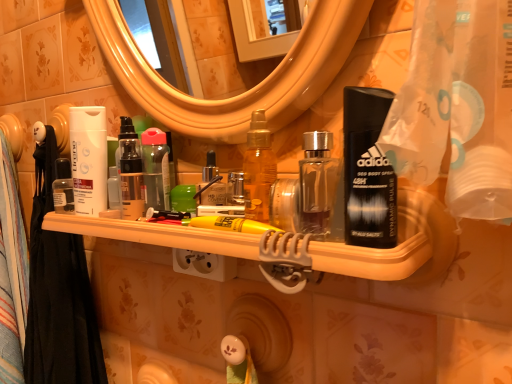
The width and height of the screenshot is (512, 384). Describe the element at coordinates (156, 169) in the screenshot. I see `transparent plastic bottle at center` at that location.

Where is `glossy plastic mirror at upper center`? This screenshot has width=512, height=384. glossy plastic mirror at upper center is located at coordinates (246, 91).

This screenshot has height=384, width=512. What do you see at coordinates (89, 159) in the screenshot? I see `white matte lotion at left` at bounding box center [89, 159].

This screenshot has height=384, width=512. What do you see at coordinates (58, 292) in the screenshot? I see `black fabric shower curtain at left` at bounding box center [58, 292].

Describe the element at coordinates (159, 235) in the screenshot. I see `translucent plastic shelf at center` at that location.

Find the location of a particular element. transparent plastic bottle at center is located at coordinates (156, 169).

From the picture: Which of these two, translucent plastic shelf at center or matte black lotion at center, stands shorter?

Standing shorter between the two is translucent plastic shelf at center.

Can we say translucent plastic shelf at center lies outside matte black lotion at center?

Yes, translucent plastic shelf at center is located beyond the bounds of matte black lotion at center.

Looking at this image, measure the distance from translucent plastic shelf at center to matte black lotion at center.

6.16 inches.

Does point (122, 150) appear closer or farther from the camera than point (39, 203)?

Clearly, point (122, 150) is closer to the camera than point (39, 203).

How much distance is there between matte black lotion at center and black fabric shower curtain at left?

matte black lotion at center is 30.42 centimeters away from black fabric shower curtain at left.

How many degrees apart are the facing directions of matte black lotion at center and black fabric shower curtain at left?

matte black lotion at center and black fabric shower curtain at left are facing 4.27 degrees away from each other.

Is matte black lotion at center to the left or to the right of black fabric shower curtain at left in the image?

In the image, matte black lotion at center appears on the right side of black fabric shower curtain at left.

In the image, is glossy plastic mirror at upper center positioned in front of or behind translucent plastic shelf at center?

glossy plastic mirror at upper center is positioned closer to the viewer than translucent plastic shelf at center.

From a real-world perspective, is glossy plastic mirror at upper center under translucent plastic shelf at center?

No, from a real-world perspective, glossy plastic mirror at upper center is not beneath translucent plastic shelf at center.

From the image's perspective, is glossy plastic mirror at upper center on translucent plastic shelf at center?

Yes.

Is glossy plastic mirror at upper center far from translucent plastic shelf at center?

No, there isn't a large distance between glossy plastic mirror at upper center and translucent plastic shelf at center.

In terms of width, does translucent plastic shelf at center look wider or thinner when compared to glossy plastic mirror at upper center?

Clearly, translucent plastic shelf at center has more width compared to glossy plastic mirror at upper center.

From the picture: Is translucent plastic shelf at center far away from glossy plastic mirror at upper center?

No, translucent plastic shelf at center is not far from glossy plastic mirror at upper center.

From the image's perspective, does translucent plastic shelf at center appear lower than glossy plastic mirror at upper center?

Yes, from the image's perspective, translucent plastic shelf at center is beneath glossy plastic mirror at upper center.

Is black fabric shower curtain at left outside of glossy plastic mirror at upper center?

Absolutely, black fabric shower curtain at left is external to glossy plastic mirror at upper center.

In the scene shown: Who is shorter, black fabric shower curtain at left or glossy plastic mirror at upper center?

glossy plastic mirror at upper center is shorter.

From a real-world perspective, does black fabric shower curtain at left sit lower than glossy plastic mirror at upper center?

Correct, in the physical world, black fabric shower curtain at left is lower than glossy plastic mirror at upper center.

Is point (108, 20) behind point (145, 145)?

Yes.

How many degrees apart are the facing directions of glossy plastic mirror at upper center and transparent plastic bottle at center?

8.67 degrees separate the facing orientations of glossy plastic mirror at upper center and transparent plastic bottle at center.

From the image's perspective, relative to transparent plastic bottle at center, is glossy plastic mirror at upper center above or below?

Clearly, from the image's perspective, glossy plastic mirror at upper center is above transparent plastic bottle at center.

Is translucent plastic shelf at center not near transparent plastic bottle at center?

translucent plastic shelf at center is actually quite close to transparent plastic bottle at center.

You are a GUI agent. You are given a task and a screenshot of the screen. Output one action in this format:
    pyautogui.click(x=<x>, y=<y>)
    Task: Click on the mouthwash that appears above the translucent plastic shelf at center (from a real-world perspective)
    The height and width of the screenshot is (384, 512).
    Given the screenshot: What is the action you would take?
    pyautogui.click(x=156, y=169)

Considering the positions of objects translucent plastic shelf at center and transparent plastic bottle at center in the image provided, who is more to the left, translucent plastic shelf at center or transparent plastic bottle at center?

transparent plastic bottle at center is more to the left.

Identify the location of shelf in front of the matte black lotion at center. The height and width of the screenshot is (384, 512). (159, 235).

Locate an element on the screen. The width and height of the screenshot is (512, 384). shower curtain that is below the matte black lotion at center (from the image's perspective) is located at coordinates (58, 292).

Looking at the image, which one is located further to black fabric shower curtain at left, glossy plastic mirror at upper center or transparent plastic bottle at center?

glossy plastic mirror at upper center lies further to black fabric shower curtain at left than the other object.

Consider the image. Based on their spatial positions, is translucent plastic shelf at center or transparent plastic bottle at center closer to glossy plastic mirror at upper center?

transparent plastic bottle at center lies closer to glossy plastic mirror at upper center than the other object.

Considering their positions, is black fabric shower curtain at left positioned further to translucent plastic shelf at center than white matte lotion at left?

Based on the image, black fabric shower curtain at left appears to be further to translucent plastic shelf at center.

Considering their positions, is glossy plastic mirror at upper center positioned further to black fabric shower curtain at left than translucent plastic shelf at center?

glossy plastic mirror at upper center is positioned further to the anchor black fabric shower curtain at left.

From the image, which object appears to be nearer to matte black lotion at center, transparent plastic bottle at center or black fabric shower curtain at left?

transparent plastic bottle at center.

Looking at the image, which one is located further to transparent plastic bottle at center, glossy plastic mirror at upper center or white matte lotion at left?

The object further to transparent plastic bottle at center is glossy plastic mirror at upper center.

Which object lies nearer to the anchor point matte black lotion at center, black fabric shower curtain at left or translucent plastic shelf at center?

translucent plastic shelf at center is positioned closer to the anchor matte black lotion at center.

From the image, which object appears to be nearer to black fabric shower curtain at left, white matte lotion at left or translucent plastic shelf at center?

translucent plastic shelf at center lies closer to black fabric shower curtain at left than the other object.

Where is `cleaning product between black fabric shower curtain at left and matte black lotion at center`? This screenshot has width=512, height=384. cleaning product between black fabric shower curtain at left and matte black lotion at center is located at coordinates (89, 159).

You are a GUI agent. You are given a task and a screenshot of the screen. Output one action in this format:
    pyautogui.click(x=<x>, y=<y>)
    Task: Click on the mouthwash between translucent plastic shelf at center and white matte lotion at left in the front-back direction
    The height and width of the screenshot is (384, 512).
    Given the screenshot: What is the action you would take?
    pyautogui.click(x=156, y=169)

In order to click on shelf between glossy plastic mirror at upper center and black fabric shower curtain at left in the front-back direction in this screenshot , I will do `click(159, 235)`.

Locate an element on the screen. This screenshot has height=384, width=512. cleaning product between black fabric shower curtain at left and transparent plastic bottle at center from left to right is located at coordinates (89, 159).